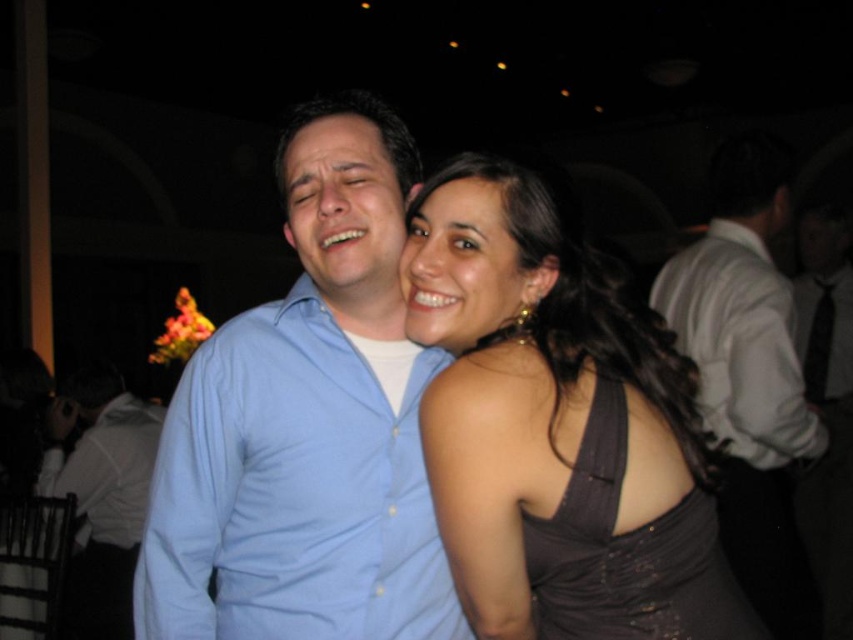
Question: Is white shirt at right to the right of white shirt at left from the viewer's perspective?

Choices:
 (A) yes
 (B) no

Answer: (A)

Question: Which point is closer to the camera taking this photo?

Choices:
 (A) (453, 509)
 (B) (120, 449)

Answer: (A)

Question: Does matte blue shirt at center appear on the left side of dark gray satin dress at center?

Choices:
 (A) yes
 (B) no

Answer: (B)

Question: Estimate the real-world distances between objects in this image. Which object is farther from the satin black dress at center?

Choices:
 (A) dark gray satin dress at center
 (B) blue button-down shirt at center
 (C) matte blue shirt at center

Answer: (C)

Question: Does matte blue shirt at center appear under white shirt at left?

Choices:
 (A) yes
 (B) no

Answer: (B)

Question: Estimate the real-world distances between objects in this image. Which object is farther from the matte blue shirt at center?

Choices:
 (A) dark gray satin dress at center
 (B) white shirt at left
 (C) satin black dress at center
 (D) white shirt at right

Answer: (B)